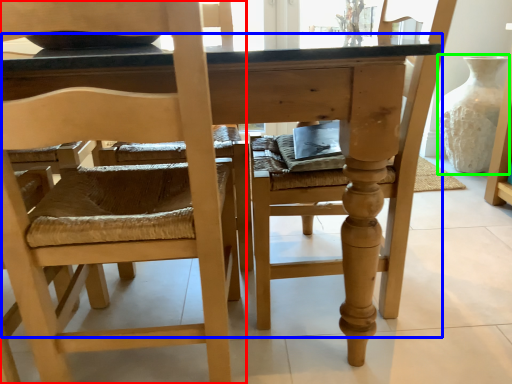
Question: Considering the real-world distances, which object is closest to chair (highlighted by a red box)? table (highlighted by a blue box) or glass vase (highlighted by a green box).

Choices:
 (A) table
 (B) glass vase

Answer: (A)